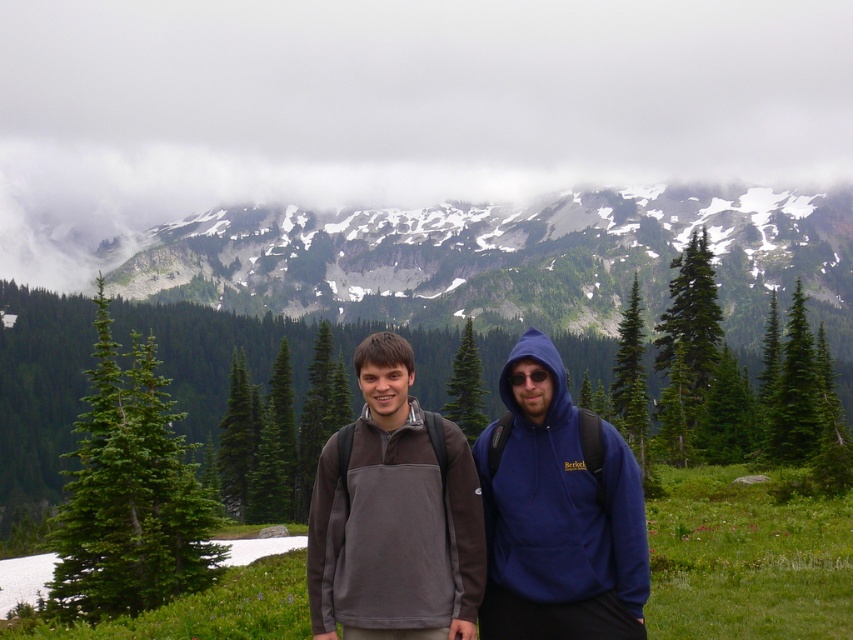
Question: Which point is closer to the camera?

Choices:
 (A) green matte pine at left
 (B) green matte pine at center
 (C) white fluffy cloud at upper center

Answer: (A)

Question: Does white fluffy cloud at upper center appear on the right side of green matte pine at left?

Choices:
 (A) no
 (B) yes

Answer: (B)

Question: Is green matte pine at left in front of green matte pine at center?

Choices:
 (A) no
 (B) yes

Answer: (B)

Question: Which object appears closest to the camera in this image?

Choices:
 (A) white fluffy cloud at upper center
 (B) green matte pine at left
 (C) green matte pine at center
 (D) dark gray fleece at center

Answer: (D)

Question: Among these points, which one is farthest from the camera?

Choices:
 (A) tap(524, 481)
 (B) tap(469, 422)
 (C) tap(114, 506)
 (D) tap(325, 104)

Answer: (D)

Question: Does dark gray fleece at center have a larger size compared to green matte pine at center?

Choices:
 (A) yes
 (B) no

Answer: (B)